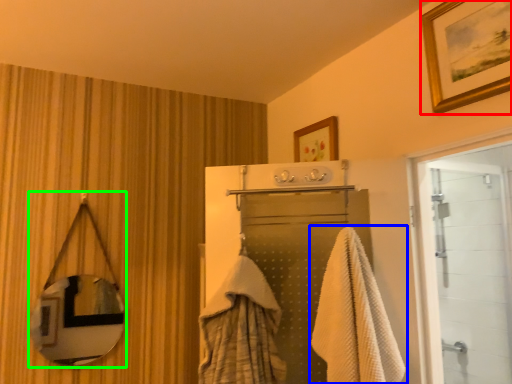
Question: Considering the real-world distances, which object is farthest from picture frame (highlighted by a red box)? towel (highlighted by a blue box) or mirror (highlighted by a green box)?

Choices:
 (A) towel
 (B) mirror

Answer: (B)